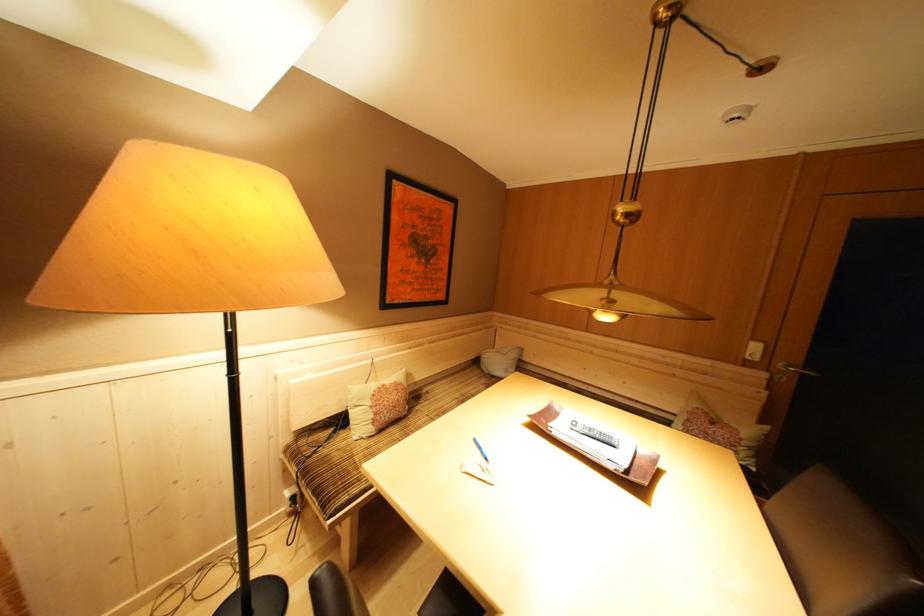
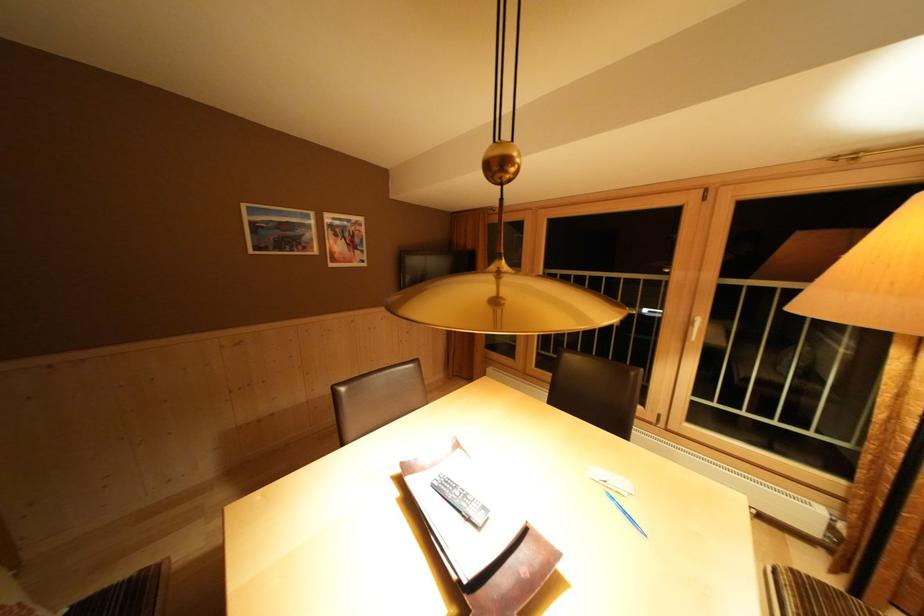
Find the pixel in the second image that matches [487,453] in the first image.

(633, 517)